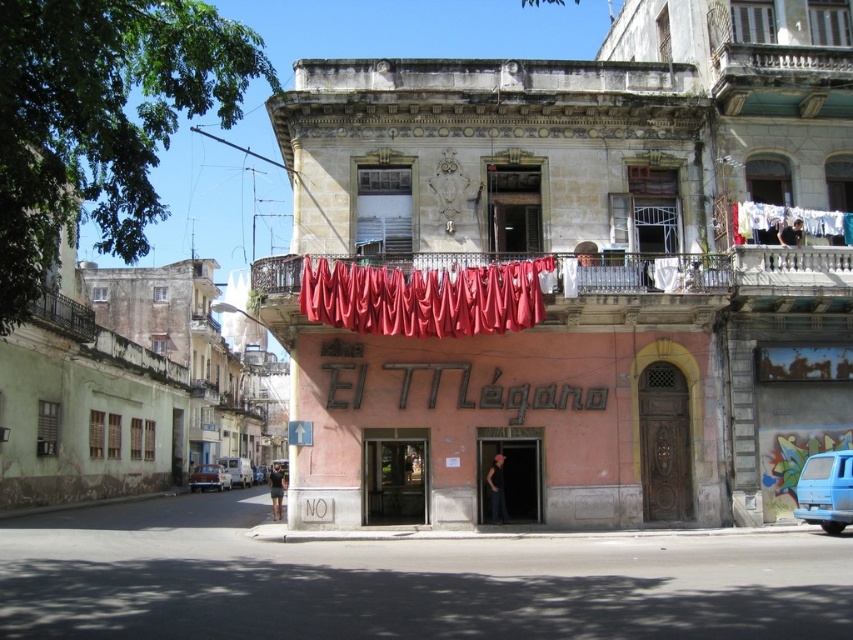
Question: Which object is closer to the camera taking this photo?

Choices:
 (A) metallic silver van at center
 (B) white matte van at lower left
 (C) shiny blue car at center

Answer: (C)

Question: Among these points, which one is nearest to the camera?

Choices:
 (A) (381, 280)
 (B) (741, 262)

Answer: (A)

Question: Does white fabric at upper right appear on the right side of metallic silver van at center?

Choices:
 (A) no
 (B) yes

Answer: (B)

Question: Is blue matte van at lower right above metallic silver van at center?

Choices:
 (A) yes
 (B) no

Answer: (A)

Question: Is white marble railing at upper center to the right of blue matte van at lower right from the viewer's perspective?

Choices:
 (A) yes
 (B) no

Answer: (B)

Question: Which object is positioned closest to the white fabric at upper right?

Choices:
 (A) rustic metal balcony at upper left
 (B) shiny blue car at center

Answer: (A)